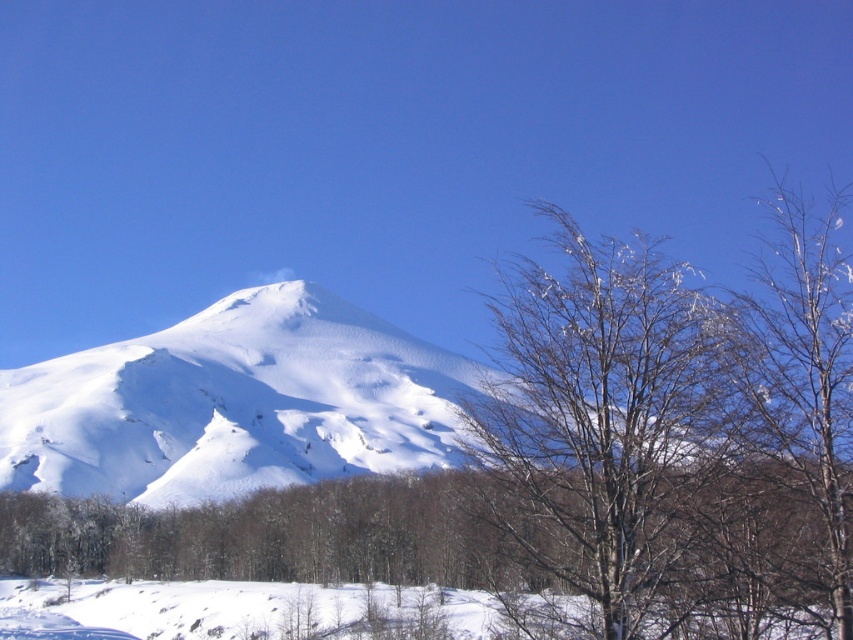
Question: Among these objects, which one is nearest to the camera?

Choices:
 (A) bare wood tree at center
 (B) snowy bare branches at right

Answer: (B)

Question: Among these objects, which one is farthest from the camera?

Choices:
 (A) snowy bare branches at right
 (B) bare wood tree at center

Answer: (B)

Question: Which object is closer to the camera taking this photo?

Choices:
 (A) bare wood tree at center
 (B) snowy bare branches at right

Answer: (B)

Question: Does bare wood tree at center lie in front of snowy bare branches at right?

Choices:
 (A) yes
 (B) no

Answer: (B)

Question: Is bare wood tree at center thinner than snowy bare branches at right?

Choices:
 (A) no
 (B) yes

Answer: (B)

Question: Can you confirm if bare wood tree at center is thinner than snowy bare branches at right?

Choices:
 (A) yes
 (B) no

Answer: (A)